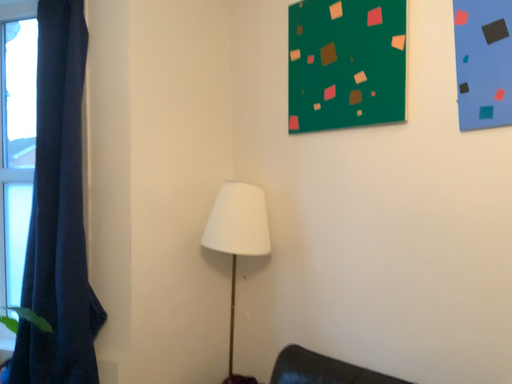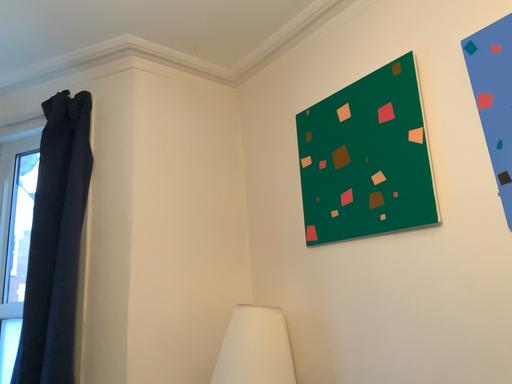
Question: How did the camera likely rotate when shooting the video?

Choices:
 (A) rotated right
 (B) rotated left

Answer: (B)